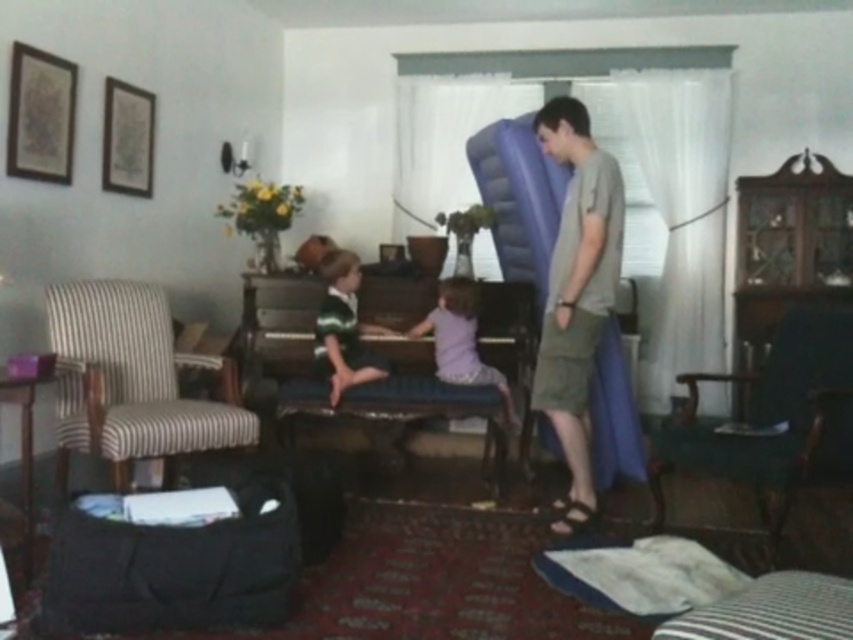
Does striped fabric armchair at left have a larger size compared to purple cotton shirt at center?

Correct, striped fabric armchair at left is larger in size than purple cotton shirt at center.

Looking at this image, does striped fabric armchair at left have a lesser width compared to purple cotton shirt at center?

No.

Is point (194, 444) in front of point (456, 344)?

Yes.

You are a GUI agent. You are given a task and a screenshot of the screen. Output one action in this format:
    pyautogui.click(x=<x>, y=<y>)
    Task: Click on the striped fabric armchair at left
    The image size is (853, 640).
    Given the screenshot: What is the action you would take?
    pyautogui.click(x=129, y=380)

Does striped fabric armchair at left lie in front of blue fabric stool at center?

Yes, it is.

Does striped fabric armchair at left have a lesser width compared to blue fabric stool at center?

Yes, striped fabric armchair at left is thinner than blue fabric stool at center.

At what (x,y) coordinates should I click in order to perform the action: click on striped fabric armchair at left. Please return your answer as a coordinate pair (x, y). Looking at the image, I should click on (129, 380).

Is point (775, 392) in front of point (564, 355)?

No, it is behind (564, 355).

This screenshot has width=853, height=640. I want to click on dark green fabric armchair at right, so click(780, 416).

Locate an element on the screen. dark green fabric armchair at right is located at coordinates (780, 416).